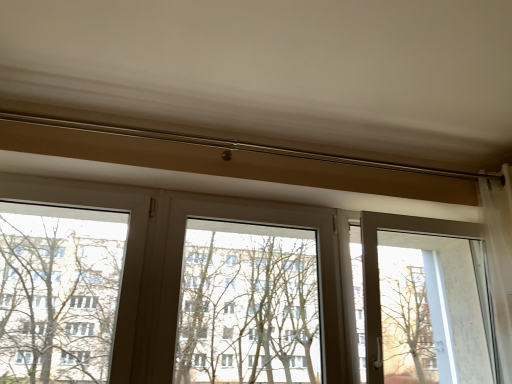
Question: Should I look upward or downward to see transparent glass screen door at right?

Choices:
 (A) down
 (B) up

Answer: (A)

Question: From the image's perspective, is transparent glass screen door at right over transparent plastic window screen at center?

Choices:
 (A) no
 (B) yes

Answer: (A)

Question: Is transparent glass screen door at right oriented away from transparent plastic window screen at center?

Choices:
 (A) no
 (B) yes

Answer: (A)

Question: From a real-world perspective, is transparent glass screen door at right positioned over transparent plastic window screen at center based on gravity?

Choices:
 (A) yes
 (B) no

Answer: (A)

Question: Can you confirm if transparent glass screen door at right is thinner than transparent plastic window screen at center?

Choices:
 (A) yes
 (B) no

Answer: (B)

Question: Does transparent glass screen door at right have a smaller size compared to transparent plastic window screen at center?

Choices:
 (A) no
 (B) yes

Answer: (A)

Question: From the image's perspective, is transparent glass screen door at right below transparent plastic window screen at center?

Choices:
 (A) yes
 (B) no

Answer: (A)

Question: Is transparent plastic window screen at center taller than transparent glass screen door at right?

Choices:
 (A) yes
 (B) no

Answer: (B)

Question: Would you consider transparent plastic window screen at center to be distant from transparent glass screen door at right?

Choices:
 (A) yes
 (B) no

Answer: (A)

Question: Considering the relative sizes of transparent plastic window screen at center and transparent glass screen door at right in the image provided, is transparent plastic window screen at center thinner than transparent glass screen door at right?

Choices:
 (A) no
 (B) yes

Answer: (B)

Question: Is transparent plastic window screen at center behind transparent glass screen door at right?

Choices:
 (A) no
 (B) yes

Answer: (A)

Question: Is the position of transparent plastic window screen at center less distant than that of transparent glass screen door at right?

Choices:
 (A) no
 (B) yes

Answer: (B)

Question: Considering the relative positions of transparent plastic window screen at center and transparent glass screen door at right in the image provided, is transparent plastic window screen at center to the right of transparent glass screen door at right from the viewer's perspective?

Choices:
 (A) no
 (B) yes

Answer: (A)

Question: From a real-world perspective, does green leafy tree at left stand above transparent glass screen door at right?

Choices:
 (A) yes
 (B) no

Answer: (B)